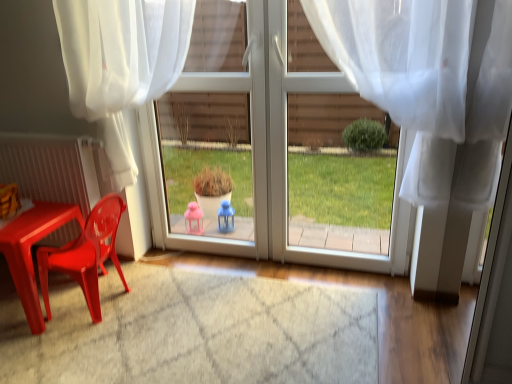
Question: Considering the positions of matte plastic chair at left and white glossy door at center in the image, is matte plastic chair at left bigger or smaller than white glossy door at center?

Choices:
 (A) big
 (B) small

Answer: (B)

Question: Looking at their shapes, would you say matte plastic chair at left is wider or thinner than white glossy door at center?

Choices:
 (A) wide
 (B) thin

Answer: (A)

Question: Which object is positioned closest to the matte plastic radiator at left?

Choices:
 (A) white glossy door at center
 (B) matte plastic table at lower left
 (C) matte plastic chair at left
 (D) translucent white curtain at center, marked as the 2th curtain in a left-to-right arrangement
 (E) white sheer curtain at upper left, which ranks as the 2th curtain in right-to-left order

Answer: (B)

Question: Which of these objects is positioned farthest from the matte plastic radiator at left?

Choices:
 (A) translucent white curtain at center, marked as the 2th curtain in a left-to-right arrangement
 (B) white glossy door at center
 (C) matte plastic chair at left
 (D) matte plastic table at lower left
 (E) white sheer curtain at upper left, which ranks as the 2th curtain in right-to-left order

Answer: (A)